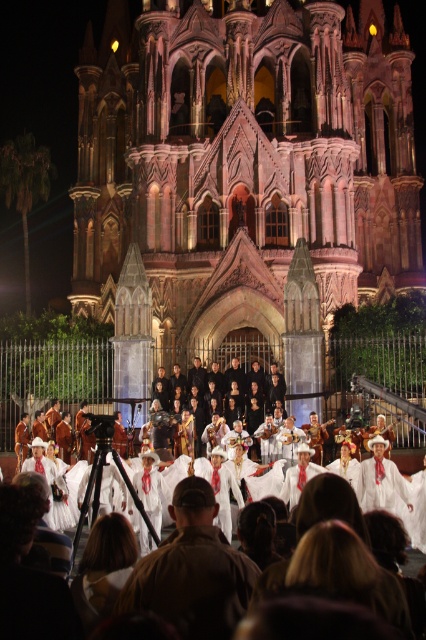
You are a photographer standing in front of the cathedral and see the pink stone church at center and the white cotton dress at center. Which object is closer to you?

The pink stone church at center is closer to you because the white cotton dress at center is behind it.

You are standing in front of the pink stone church at center and the white cotton dress at center. Which object is located to the left of the other?

The white cotton dress at center is located to the left of the pink stone church at center because the pink stone church at center is positioned on the right side of the white cotton dress at center.

In the scene shown: You are standing at the entrance of the pink stone church at center. You want to walk to the point marked at coordinate 0.263 on the x axis and 0.575 on the y axis. Is this point inside the church?

The pink stone church at center is located at the coordinates (244,168), so the point you are referring to is exactly at the center of the church. Therefore, the point is inside the church.